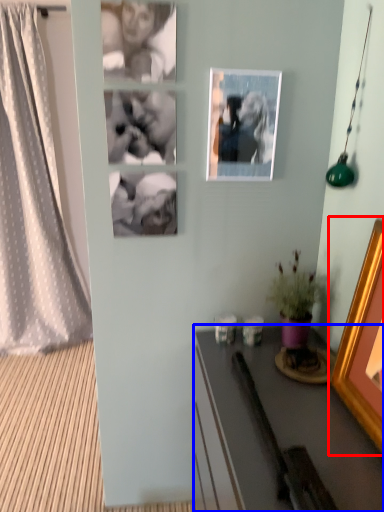
Question: Which point is further to the camera, picture frame (highlighted by a red box) or desk (highlighted by a blue box)?

Choices:
 (A) picture frame
 (B) desk

Answer: (B)